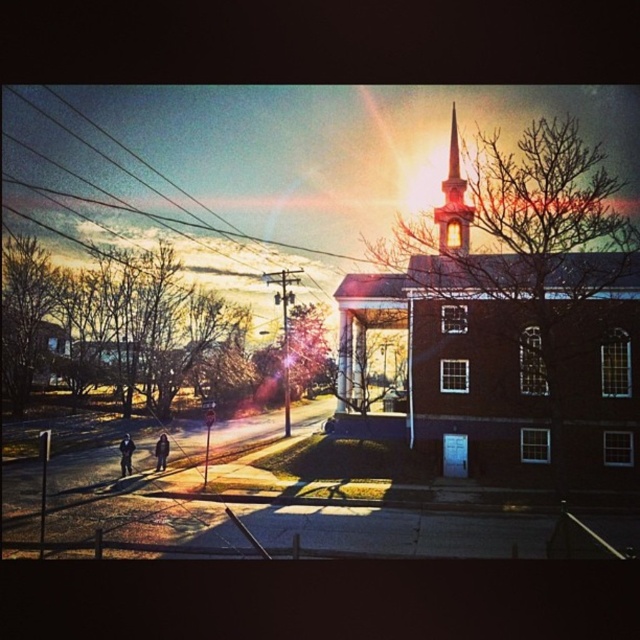
Question: Which object appears farthest from the camera in this image?

Choices:
 (A) smooth brick steeple at upper center
 (B) brick church at center
 (C) metallic wires at upper left

Answer: (C)

Question: Which object appears closest to the camera in this image?

Choices:
 (A) brick church at center
 (B) metallic wires at upper left
 (C) smooth brick steeple at upper center

Answer: (A)

Question: Does metallic wires at upper left have a larger size compared to smooth brick steeple at upper center?

Choices:
 (A) yes
 (B) no

Answer: (B)

Question: Can you confirm if metallic wires at upper left is positioned to the right of smooth brick steeple at upper center?

Choices:
 (A) no
 (B) yes

Answer: (A)

Question: Which point is closer to the camera?

Choices:
 (A) (358, 365)
 (B) (102, 150)

Answer: (A)

Question: Does metallic wires at upper left have a greater width compared to smooth brick steeple at upper center?

Choices:
 (A) yes
 (B) no

Answer: (A)